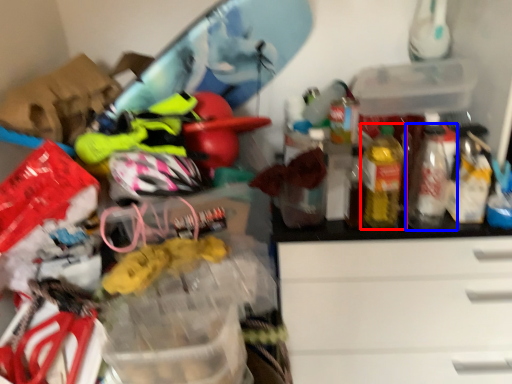
Question: Which object appears farthest to the camera in this image, bottle (highlighted by a red box) or bottle (highlighted by a blue box)?

Choices:
 (A) bottle
 (B) bottle

Answer: (B)